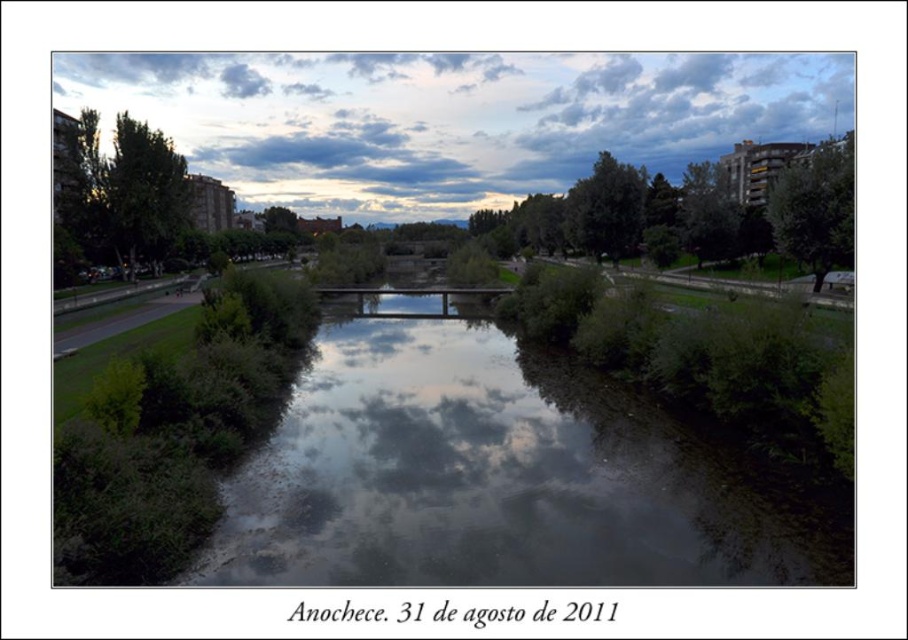
You are an architect designing a new bridge over the river. Based on the scene, which object occupies a larger vertical space in the image? Please consider the green leafy river at center and the cloudy sky at upper center.

The cloudy sky at upper center occupies a larger vertical space than the green leafy river at center because the river is not as tall as the sky in the image.

You are an architect designing a new riverside walkway. You want to ensure visitors can enjoy both the green leafy river at center and the cloudy sky at upper center. Based on their positions, which object would appear higher in the scene?

The cloudy sky at upper center appears higher in the scene as it is positioned above the green leafy river at center.

You are standing at the center of the image. Which direction should you move to reach the green leafy river at center?

The green leafy river at center is located at coordinates point (498, 477), so you should move towards the lower right direction to reach it.